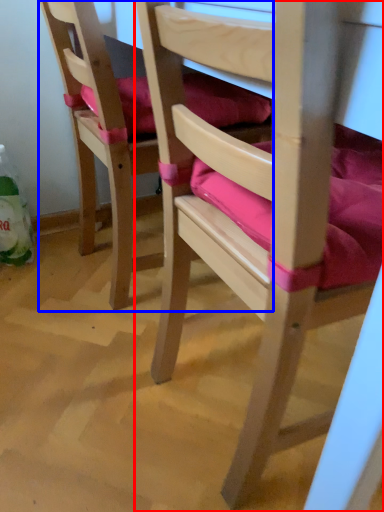
Question: Among these objects, which one is farthest to the camera, chair (highlighted by a red box) or chair (highlighted by a blue box)?

Choices:
 (A) chair
 (B) chair

Answer: (B)